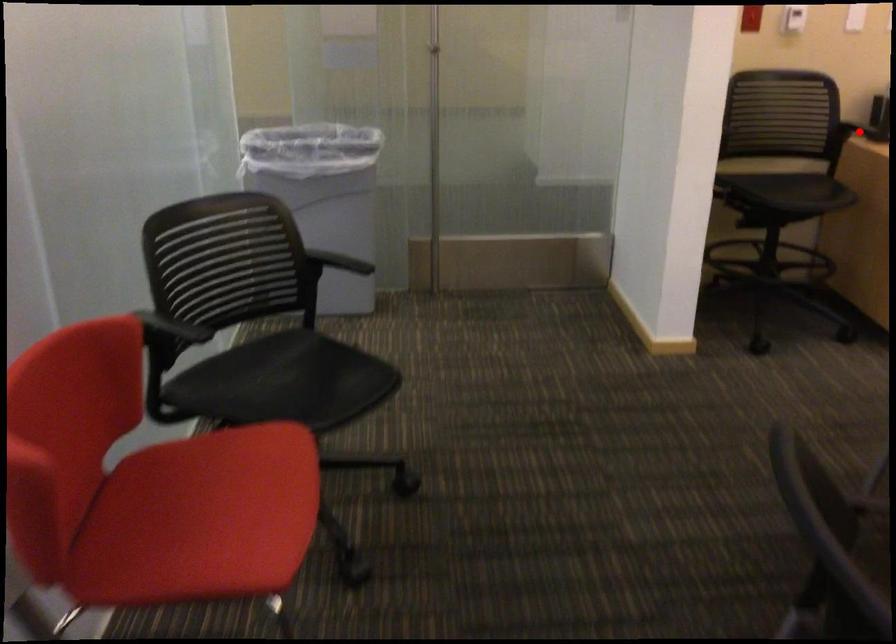
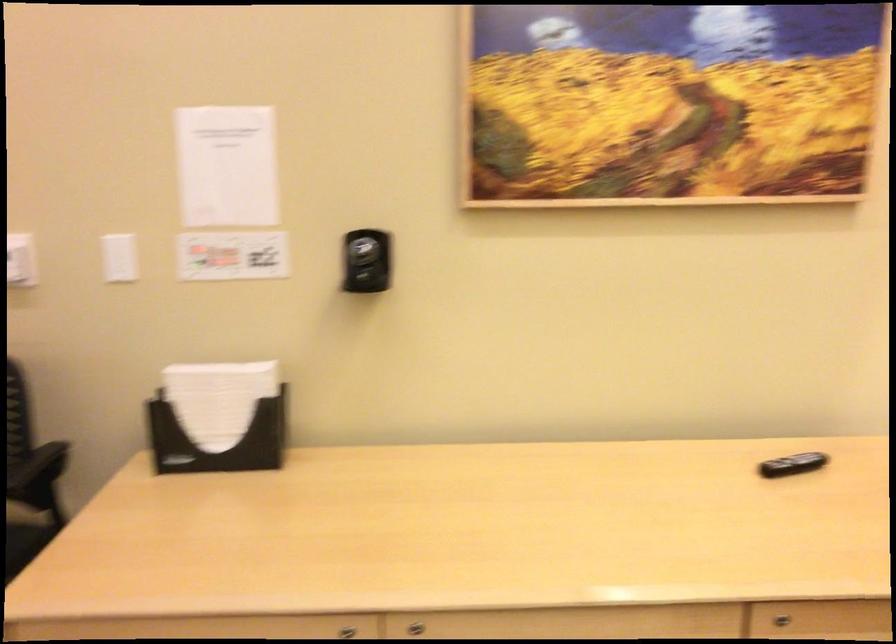
Question: I am providing you with two images of the same scene from different viewpoints. A red point is marked on the first image. Can you still see the location of the red point in image 2?

Choices:
 (A) Yes
 (B) No

Answer: (B)